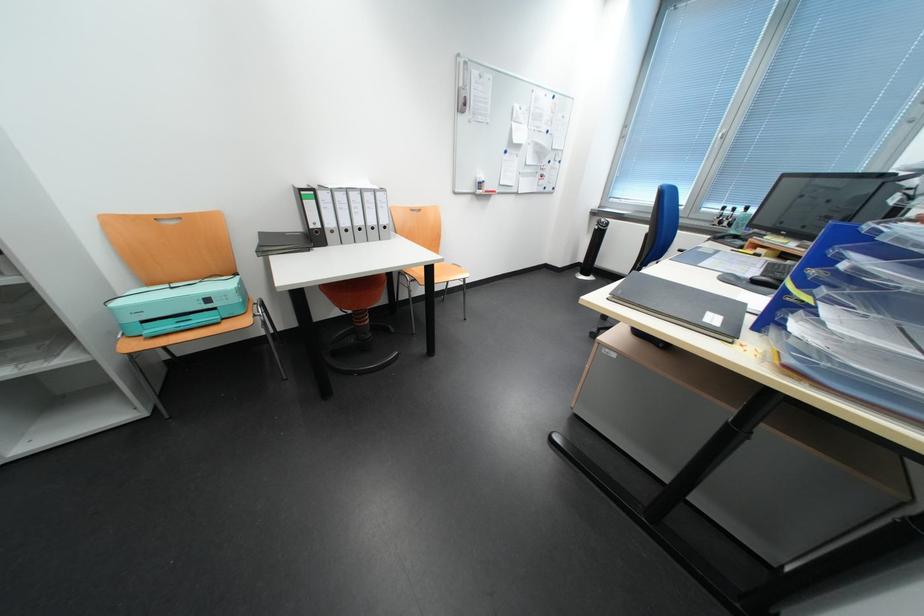
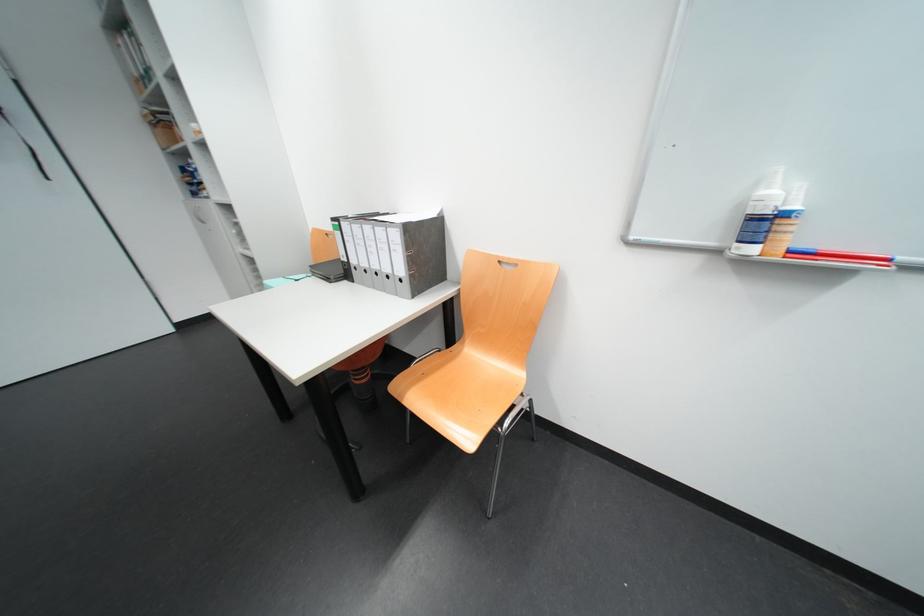
Locate, in the second image, the point that corresponds to [331,228] in the first image.

(358, 262)